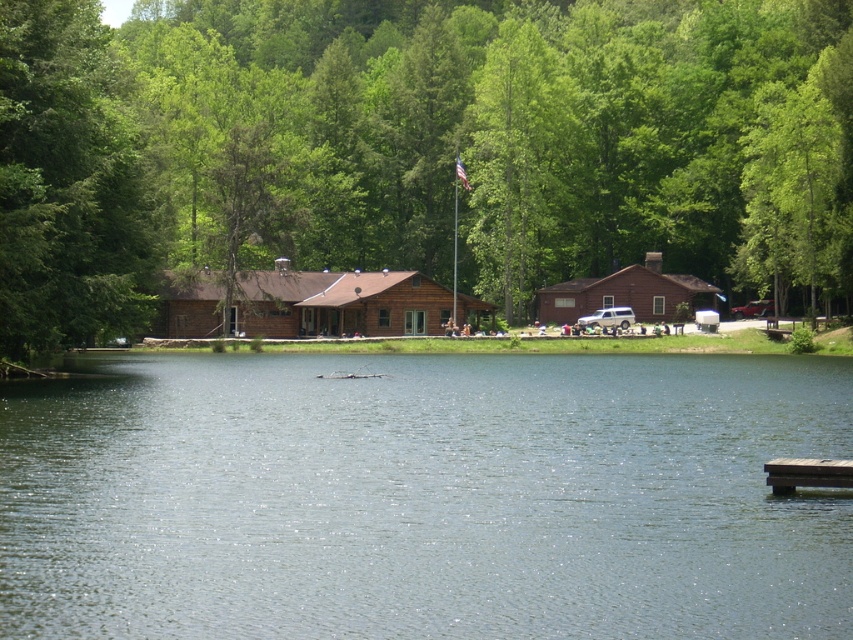
You are standing at the edge of the lake and want to reach the brown wooden cabin at center. If your walking speed is 3 feet per second, how many seconds will it take you to reach the cabin?

The distance of brown wooden cabin at center from camera is 320.06 feet. At a walking speed of 3 feet per second, it would take approximately 106.69 seconds to reach the cabin.

You are standing at the lakeside and see two brown cabins in front of you. Which one is closer to you, the brown wooden cabin at center or the brown wood cabin at center?

The brown wooden cabin at center is closer to the viewer than the brown wood cabin at center.